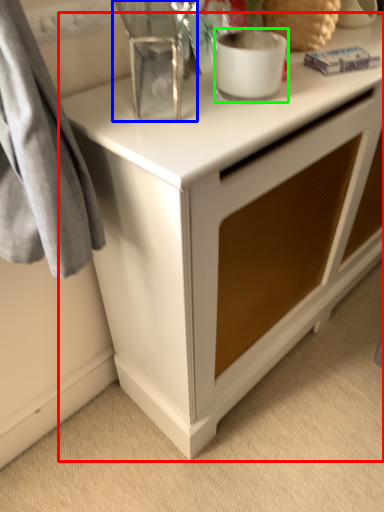
Question: Which object is the farthest from desk (highlighted by a red box)? Choose among these: appliance (highlighted by a blue box) or appliance (highlighted by a green box).

Choices:
 (A) appliance
 (B) appliance

Answer: (B)